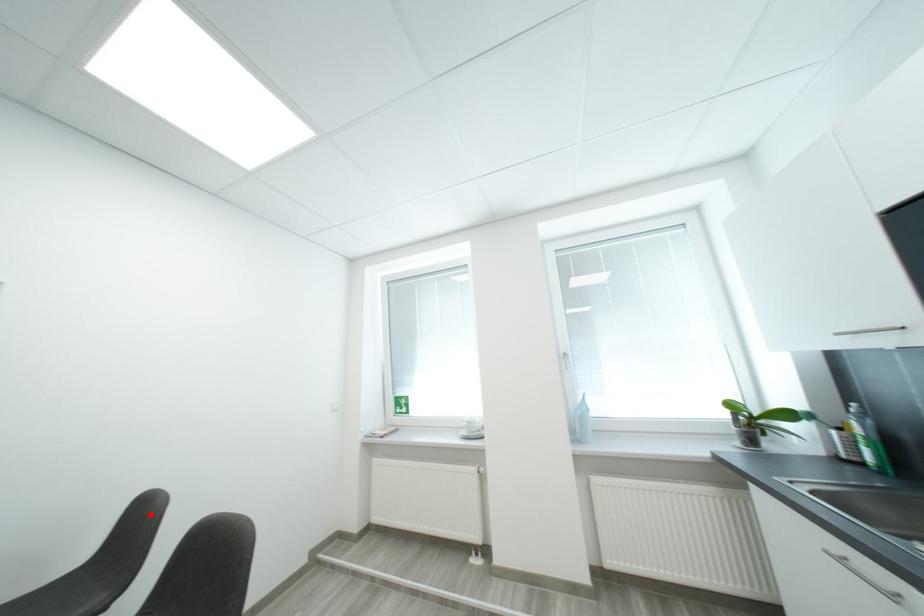
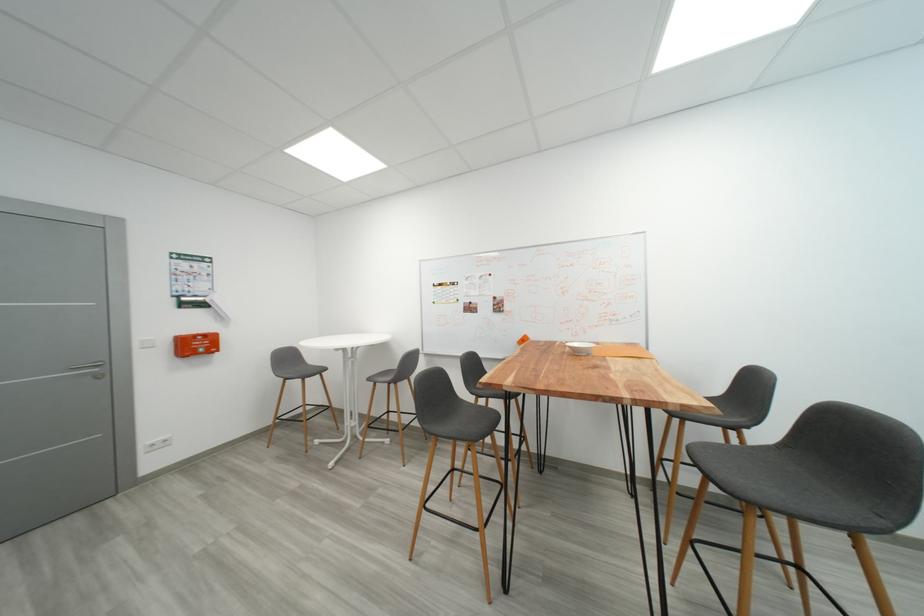
The point at the highlighted location is marked in the first image. Where is the corresponding point in the second image?

(761, 381)